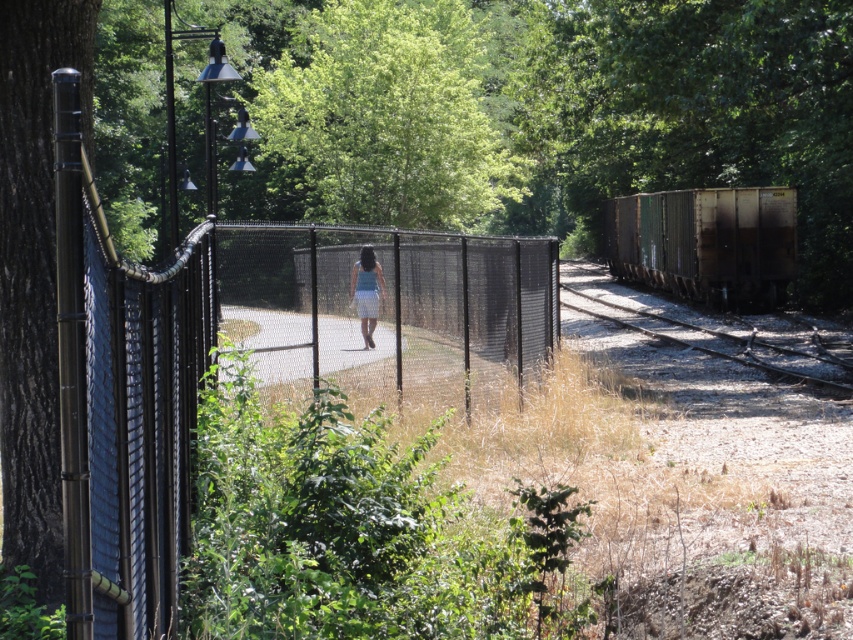
Question: Which point is closer to the camera?

Choices:
 (A) (813, 372)
 (B) (160, 422)

Answer: (B)

Question: Does black metal fence at left appear on the left side of rusty metal train track at right?

Choices:
 (A) yes
 (B) no

Answer: (A)

Question: Which point is farther to the camera?

Choices:
 (A) click(x=355, y=304)
 (B) click(x=380, y=353)
 (C) click(x=131, y=536)
 (D) click(x=781, y=211)

Answer: (D)

Question: Can you confirm if smooth brown tree trunk at left is wider than rusty metal train car at right?

Choices:
 (A) yes
 (B) no

Answer: (B)

Question: Estimate the real-world distances between objects in this image. Which object is farther from the smooth brown tree trunk at left?

Choices:
 (A) rusty metal train car at right
 (B) rusty metal train track at right
 (C) smooth concrete path at center

Answer: (A)

Question: From the image, what is the correct spatial relationship of rusty metal train car at right in relation to smooth concrete path at center?

Choices:
 (A) above
 (B) below

Answer: (A)